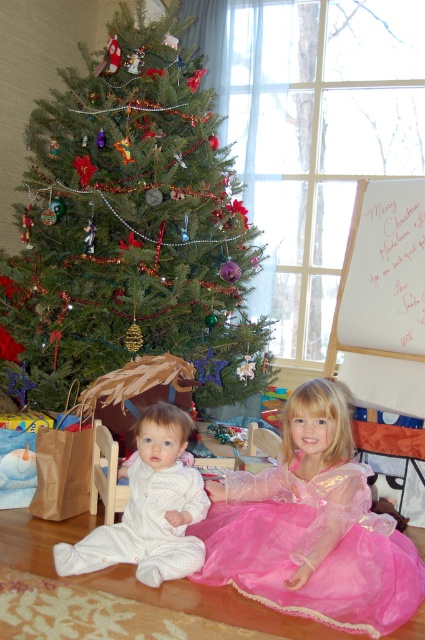
You are a photographer standing in front of the Christmas tree and want to take a photo of both the baby in white pajamas and the girl in the pink princess dress. You notice two points marked in the scene. Which point is closer to you, point (x=155, y=180) or point (x=130, y=540)?

Point (x=155, y=180) is closer to you than point (x=130, y=540).

You are a parent trying to hang a new ornament on the green matte christmas tree at upper left while your baby is sitting in the white soft pajamas at lower left. Considering the height difference between the two, can you reach the top of the tree without moving the baby?

The green matte christmas tree at upper left is much taller than the white soft pajamas at lower left, so you can safely reach the top of the tree without needing to move the baby since the tree is significantly taller.